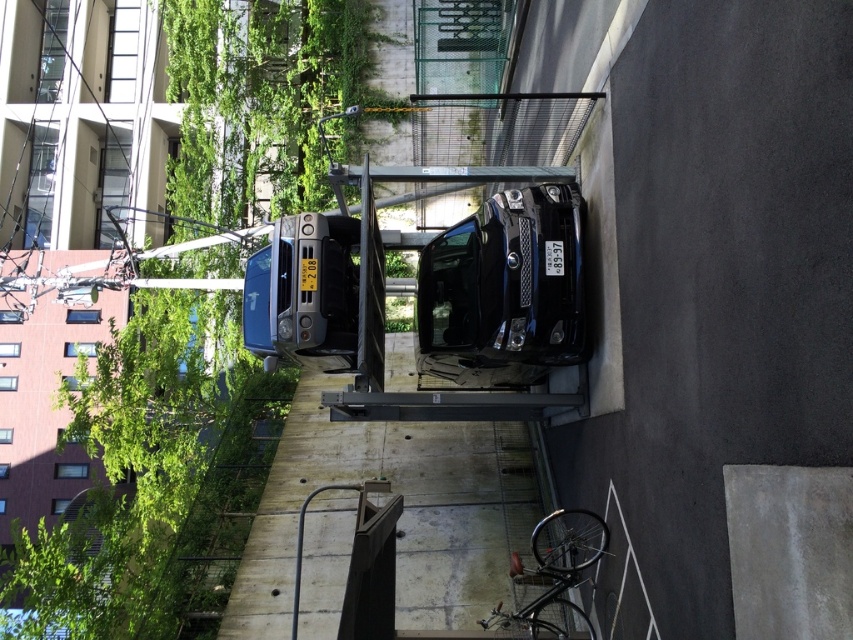
Question: Is green leafy vegetation at upper left to the left of concrete wall at center from the viewer's perspective?

Choices:
 (A) yes
 (B) no

Answer: (A)

Question: Can you confirm if green leafy vegetation at upper left is positioned below concrete wall at center?

Choices:
 (A) no
 (B) yes

Answer: (A)

Question: In this image, where is green leafy vegetation at upper left located relative to concrete wall at center?

Choices:
 (A) below
 (B) above

Answer: (B)

Question: Which of the following is the closest to the observer?

Choices:
 (A) concrete wall at center
 (B) green leafy vegetation at upper left

Answer: (A)

Question: Among these points, which one is nearest to the camera?

Choices:
 (A) (428, 424)
 (B) (187, 448)

Answer: (A)